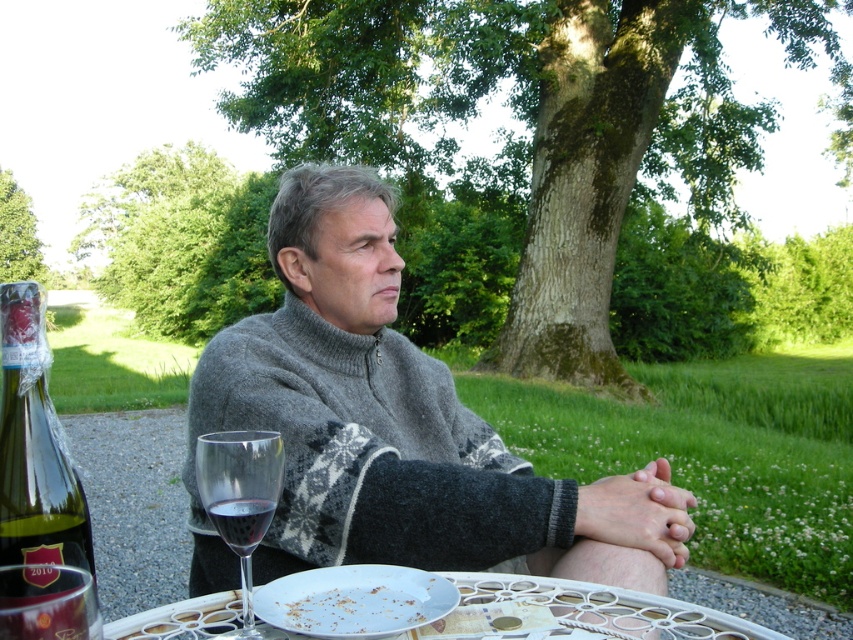
You are a guest at this table. You want to reach for the plate that has food remnants. Which plate should you choose between the white plastic plate at lower center and the white porcelain plate at lower center?

The white porcelain plate at lower center is behind the white plastic plate at lower center, so the plate with food remnants is likely the white plastic plate at lower center since it is in front.

In the scene described, where is the green glass bottle at lower left located in terms of coordinates?

The green glass bottle at lower left is located at coordinates point (35, 449).